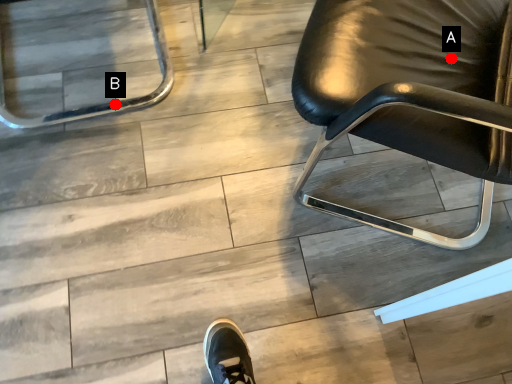
Question: Two points are circled on the image, labeled by A and B beside each circle. Which point is farther from the camera taking this photo?

Choices:
 (A) A is further
 (B) B is further

Answer: (B)